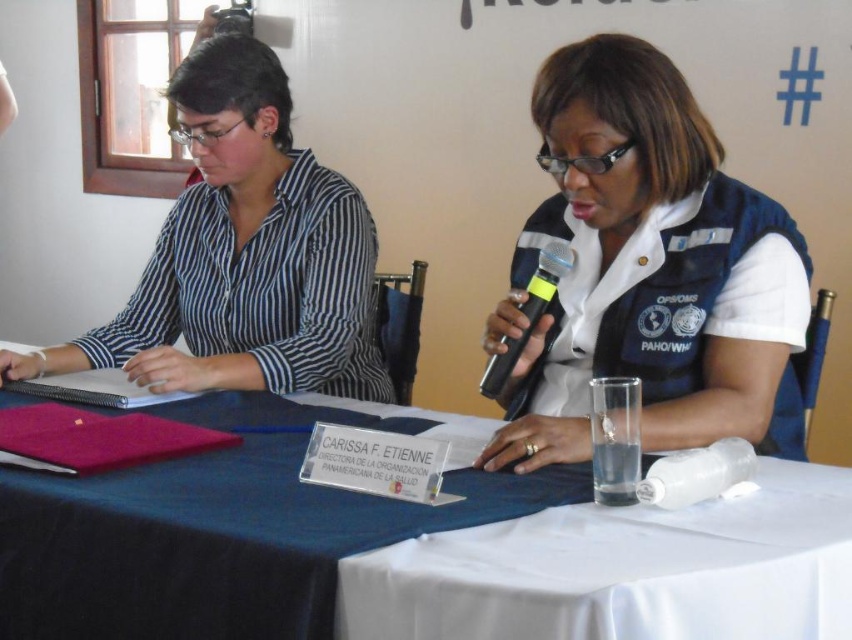
You are a photographer setting up for a formal event. You need to place a decorative vase between the white cloth at center and the black plastic microphone at center so it doesn

The white cloth at center is taller than the black plastic microphone at center, so the vase should be placed between them to avoid blocking the microphone.

You are attending a formal event and need to locate two specific items on the table. The items are the white matte vest at center and the matte black shirt at left. Which item is positioned to the right of the other?

The white matte vest at center is to the right of the matte black shirt at left.

You are attending a formal event and need to sit between the two individuals. Based on their positions, where should you sit relative to the matte black shirt at left?

Since the matte black shirt at left is located at point (x=243, y=253), you should sit to the right of the matte black shirt at left to be between the two individuals.